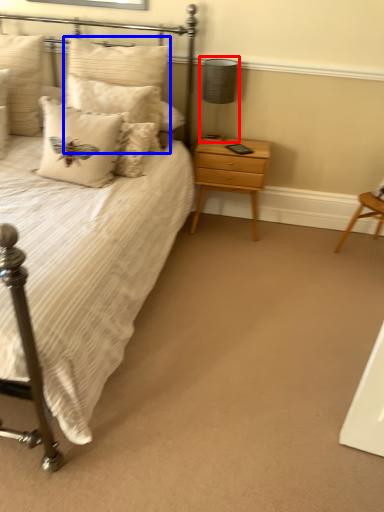
Question: Which object appears farthest to the camera in this image, table lamp (highlighted by a red box) or pillow (highlighted by a blue box)?

Choices:
 (A) table lamp
 (B) pillow

Answer: (A)